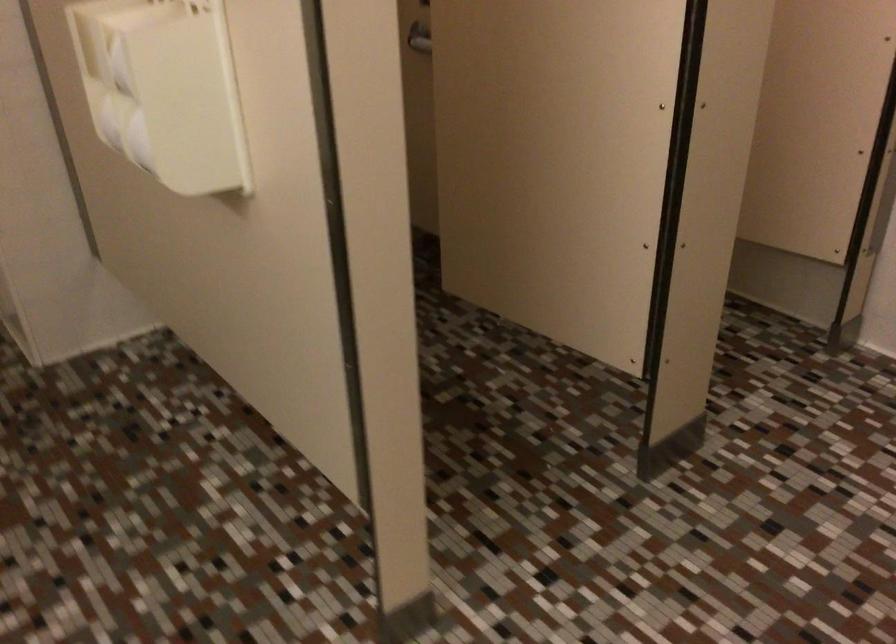
Describe the element at coordinates (418, 38) in the screenshot. This screenshot has width=896, height=644. I see `the metal coat hook` at that location.